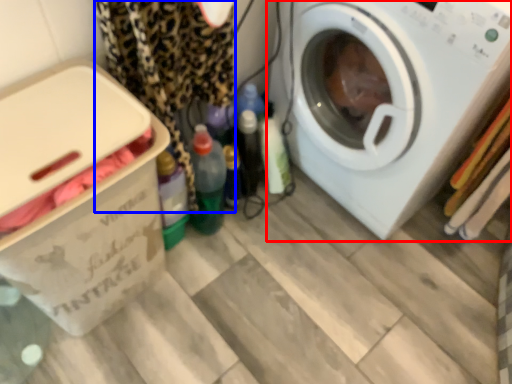
Question: Among these objects, which one is nearest to the camera, washing machine (highlighted by a red box) or clothing (highlighted by a blue box)?

Choices:
 (A) washing machine
 (B) clothing

Answer: (B)